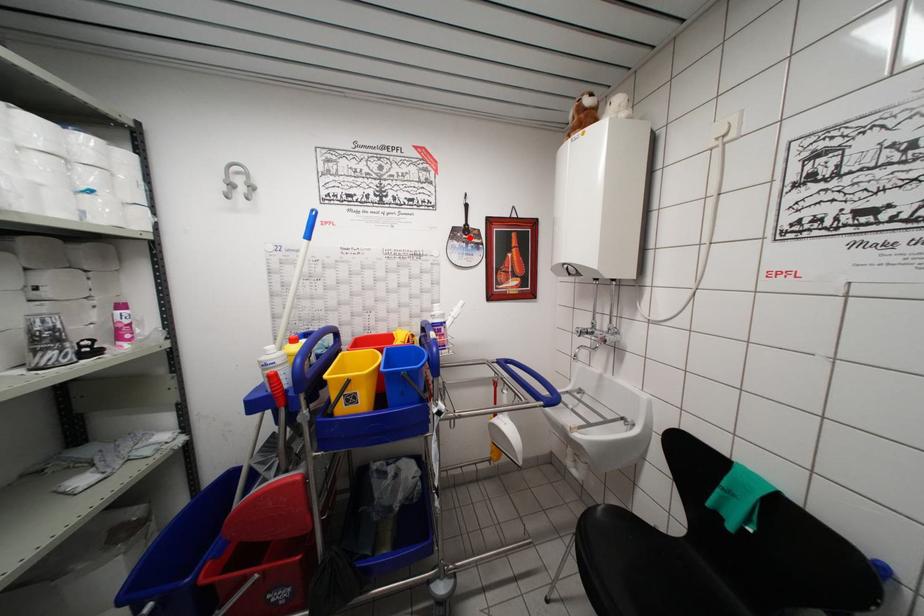
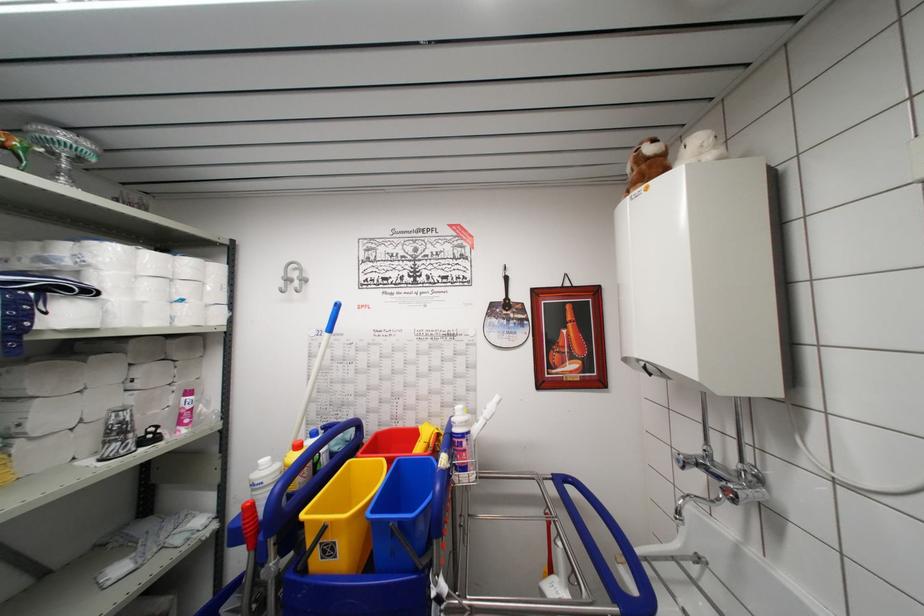
The point at the highlighted location is marked in the first image. Where is the corresponding point in the second image?

(511, 313)